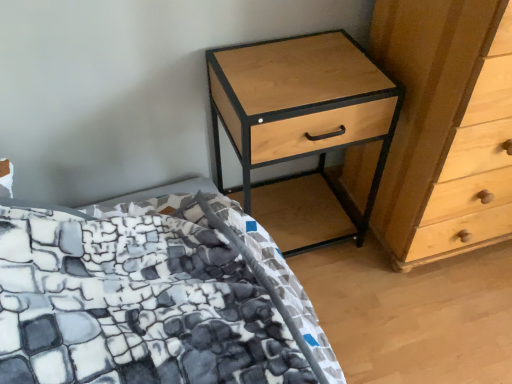
Question: Considering the relative positions of light wood/texture chest of drawers at right and light wood/black metal nightstand at upper right in the image provided, is light wood/texture chest of drawers at right to the left of light wood/black metal nightstand at upper right from the viewer's perspective?

Choices:
 (A) no
 (B) yes

Answer: (A)

Question: From a real-world perspective, is light wood/texture chest of drawers at right over light wood/black metal nightstand at upper right?

Choices:
 (A) yes
 (B) no

Answer: (A)

Question: Considering the relative sizes of light wood/texture chest of drawers at right and light wood/black metal nightstand at upper right in the image provided, is light wood/texture chest of drawers at right bigger than light wood/black metal nightstand at upper right?

Choices:
 (A) no
 (B) yes

Answer: (B)

Question: From a real-world perspective, does light wood/texture chest of drawers at right sit lower than light wood/black metal nightstand at upper right?

Choices:
 (A) no
 (B) yes

Answer: (A)

Question: Is light wood/texture chest of drawers at right positioned before light wood/black metal nightstand at upper right?

Choices:
 (A) no
 (B) yes

Answer: (B)

Question: Is light wood/texture chest of drawers at right at the right side of light wood/black metal nightstand at upper right?

Choices:
 (A) yes
 (B) no

Answer: (A)

Question: Considering the relative sizes of light wood/black metal nightstand at upper right and light wood/texture chest of drawers at right in the image provided, is light wood/black metal nightstand at upper right thinner than light wood/texture chest of drawers at right?

Choices:
 (A) yes
 (B) no

Answer: (A)

Question: Is light wood/black metal nightstand at upper right not close to light wood/texture chest of drawers at right?

Choices:
 (A) no
 (B) yes

Answer: (A)

Question: Is light wood/black metal nightstand at upper right facing towards light wood/texture chest of drawers at right?

Choices:
 (A) yes
 (B) no

Answer: (B)

Question: Is light wood/black metal nightstand at upper right at the right side of light wood/texture chest of drawers at right?

Choices:
 (A) yes
 (B) no

Answer: (B)

Question: Does light wood/black metal nightstand at upper right have a greater height compared to light wood/texture chest of drawers at right?

Choices:
 (A) no
 (B) yes

Answer: (A)

Question: From a real-world perspective, is light wood/black metal nightstand at upper right positioned over light wood/texture chest of drawers at right based on gravity?

Choices:
 (A) no
 (B) yes

Answer: (A)

Question: From a real-world perspective, is stone-patterned fabric bed at lower left under light wood/black metal nightstand at upper right?

Choices:
 (A) yes
 (B) no

Answer: (A)